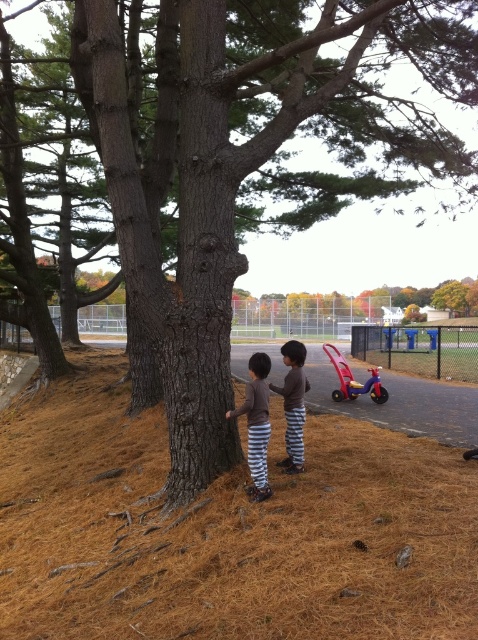
Question: Which object appears closest to the camera in this image?

Choices:
 (A) brown textured tree trunk at center
 (B) matte brown shirt at center
 (C) brown cotton shirt at center

Answer: (B)

Question: Which point is farther to the camera?

Choices:
 (A) (264, 355)
 (B) (297, 461)
 (C) (26, 401)

Answer: (C)

Question: Does matte brown shirt at center appear on the left side of brown cotton shirt at center?

Choices:
 (A) no
 (B) yes

Answer: (B)

Question: Does matte brown shirt at center have a smaller size compared to brown cotton shirt at center?

Choices:
 (A) yes
 (B) no

Answer: (A)

Question: Can you confirm if matte brown shirt at center is positioned above brown cotton shirt at center?

Choices:
 (A) no
 (B) yes

Answer: (B)

Question: Which object appears closest to the camera in this image?

Choices:
 (A) brown cotton shirt at center
 (B) brown textured tree trunk at center

Answer: (B)